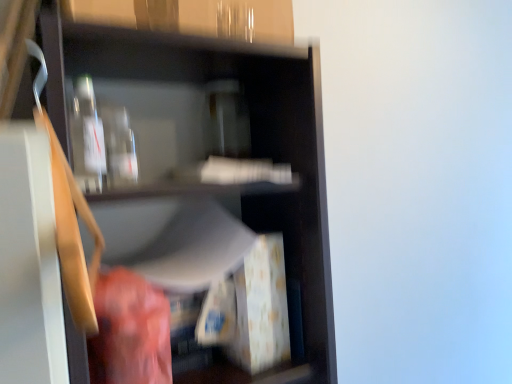
Question: Can you confirm if transparent glass bottles at upper center is wider than transparent glass bottle at upper left?

Choices:
 (A) no
 (B) yes

Answer: (B)

Question: From a real-world perspective, is transparent glass bottles at upper center on transparent glass bottle at upper left?

Choices:
 (A) yes
 (B) no

Answer: (A)

Question: From the image's perspective, is transparent glass bottles at upper center on top of transparent glass bottle at upper left?

Choices:
 (A) yes
 (B) no

Answer: (A)

Question: Would you say transparent glass bottles at upper center is a long distance from transparent glass bottle at upper left?

Choices:
 (A) no
 (B) yes

Answer: (A)

Question: Does transparent glass bottles at upper center touch transparent glass bottle at upper left?

Choices:
 (A) no
 (B) yes

Answer: (A)

Question: Considering the positions of transparent glass bottle at upper left and transparent glass bottles at upper center in the image, is transparent glass bottle at upper left wider or thinner than transparent glass bottles at upper center?

Choices:
 (A) thin
 (B) wide

Answer: (A)

Question: From their relative heights in the image, would you say transparent glass bottle at upper left is taller or shorter than transparent glass bottles at upper center?

Choices:
 (A) short
 (B) tall

Answer: (A)

Question: Does point (87, 144) appear closer or farther from the camera than point (110, 3)?

Choices:
 (A) closer
 (B) farther

Answer: (B)

Question: Would you say transparent glass bottle at upper left is to the left or to the right of transparent glass bottles at upper center in the picture?

Choices:
 (A) left
 (B) right

Answer: (A)

Question: From the image's perspective, is matte black shelf at center above or below transparent glass bottles at upper center?

Choices:
 (A) above
 (B) below

Answer: (B)

Question: Considering the positions of matte black shelf at center and transparent glass bottles at upper center in the image, is matte black shelf at center wider or thinner than transparent glass bottles at upper center?

Choices:
 (A) thin
 (B) wide

Answer: (B)

Question: Considering the relative positions of matte black shelf at center and transparent glass bottles at upper center in the image provided, is matte black shelf at center to the left or to the right of transparent glass bottles at upper center?

Choices:
 (A) right
 (B) left

Answer: (A)

Question: Relative to transparent glass bottles at upper center, is matte black shelf at center in front or behind?

Choices:
 (A) behind
 (B) front

Answer: (B)

Question: In terms of size, does transparent glass bottles at upper center appear bigger or smaller than matte black shelf at center?

Choices:
 (A) big
 (B) small

Answer: (B)

Question: From the image's perspective, is transparent glass bottles at upper center positioned above or below matte black shelf at center?

Choices:
 (A) above
 (B) below

Answer: (A)